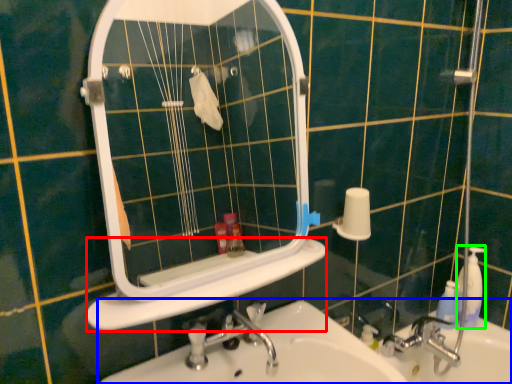
Question: Based on their relative distances, which object is nearer to ledge (highlighted by a red box)? Choose from sink (highlighted by a blue box) and soap dispenser (highlighted by a green box).

Choices:
 (A) sink
 (B) soap dispenser

Answer: (A)